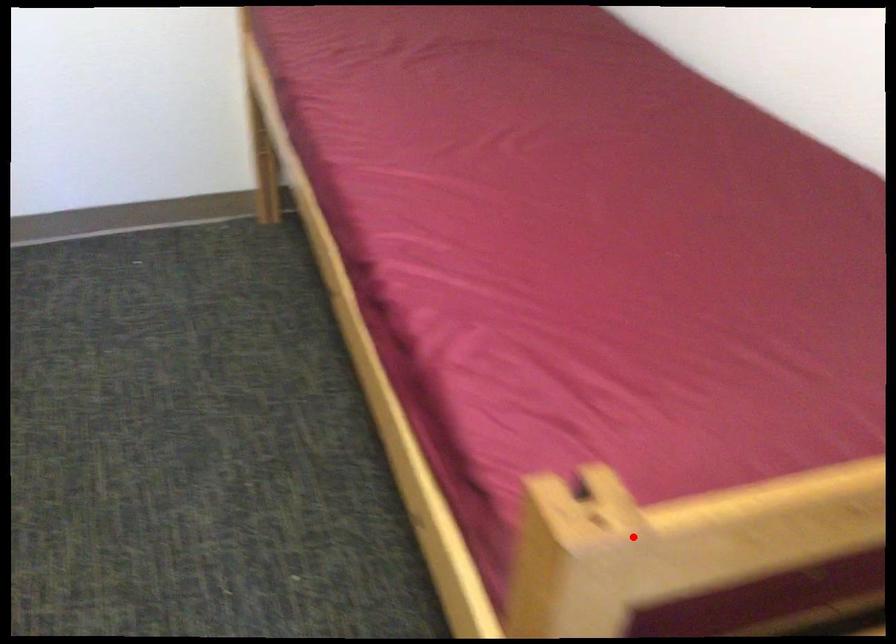
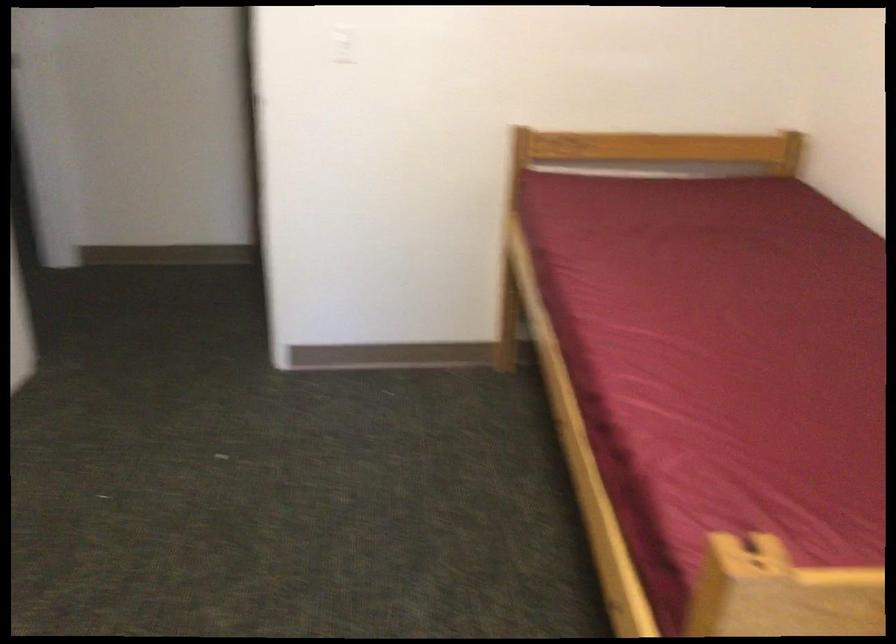
Question: I am providing you with two images of the same scene from different viewpoints. Image1 has a red point marked. In image2, the corresponding 3D location appears at what relative position? Reply with the corresponding letter.

Choices:
 (A) Closer
 (B) Farther

Answer: (B)